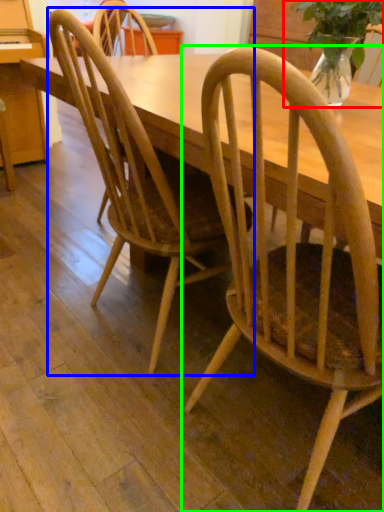
Question: Estimate the real-world distances between objects in this image. Which object is closer to houseplant (highlighted by a red box), chair (highlighted by a blue box) or chair (highlighted by a green box)?

Choices:
 (A) chair
 (B) chair

Answer: (B)